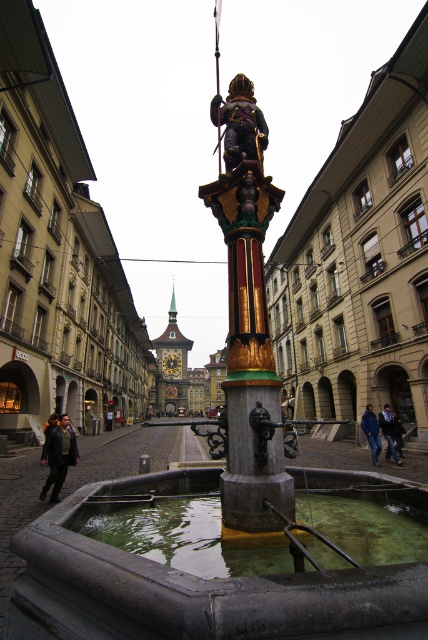
Question: Based on their relative distances, which object is farther from the dark gray jacket at lower left?

Choices:
 (A) gold clock tower at center
 (B) gold/yellow metal clock at center
 (C) gold polished statue at center

Answer: (A)

Question: Which point is farther to the camera?

Choices:
 (A) (58, 460)
 (B) (234, 125)
 (C) (398, 461)

Answer: (C)

Question: Observing the image, what is the correct spatial positioning of gold polished statue at center in reference to dark gray jacket at lower left?

Choices:
 (A) above
 (B) below

Answer: (A)

Question: Does dark gray jacket at lower left have a larger size compared to dark blue jeans at lower right?

Choices:
 (A) no
 (B) yes

Answer: (B)

Question: Can you confirm if gold clock tower at center is positioned above dark gray jacket at lower left?

Choices:
 (A) yes
 (B) no

Answer: (B)

Question: Among these objects, which one is nearest to the camera?

Choices:
 (A) gold/yellow metal clock at center
 (B) gold clock tower at center

Answer: (B)